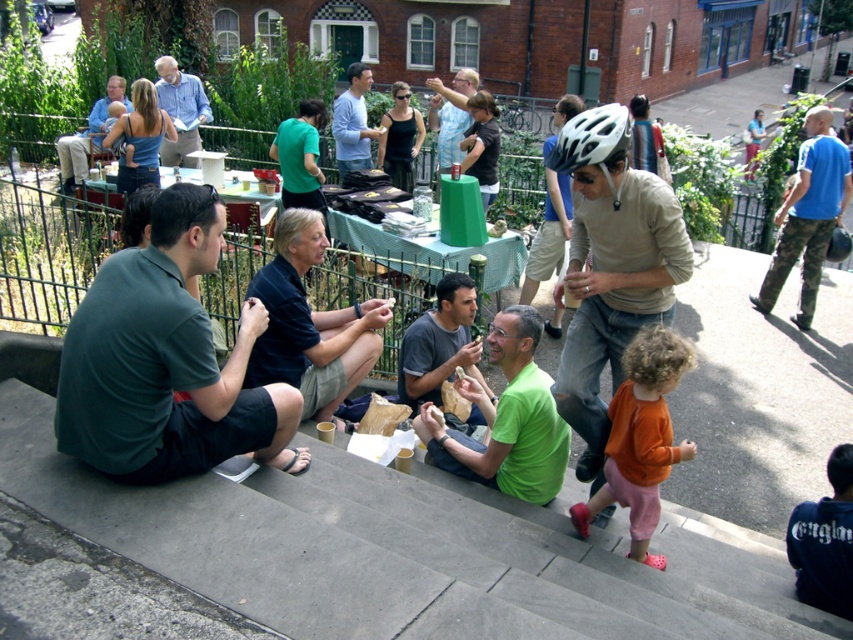
Question: Which object is closer to the camera taking this photo?

Choices:
 (A) green matte shirt at center
 (B) light blue shirt at upper center
 (C) dark blue cotton shirt at center

Answer: (A)

Question: Which of the following is the farthest from the observer?

Choices:
 (A) (799, 179)
 (B) (126, 326)
 (C) (78, 140)
 (D) (457, 122)

Answer: (C)

Question: Considering the relative positions of matte beige helmet at center and dark blue cotton shirt at center in the image provided, where is matte beige helmet at center located with respect to dark blue cotton shirt at center?

Choices:
 (A) above
 (B) below

Answer: (A)

Question: Does matte beige helmet at center lie behind light blue shirt at center?

Choices:
 (A) no
 (B) yes

Answer: (A)

Question: Among these points, which one is farthest from the camera?

Choices:
 (A) (357, 166)
 (B) (419, 324)
 (C) (442, 141)

Answer: (A)

Question: Does dark blue cotton shirt at center have a smaller size compared to light blue shirt at center?

Choices:
 (A) no
 (B) yes

Answer: (A)